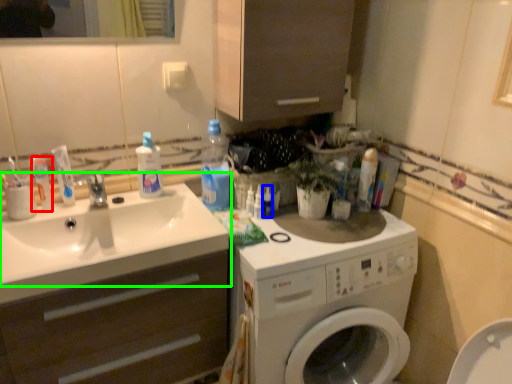
Question: Estimate the real-world distances between objects in this image. Which object is farther from toothpaste (highlighted by a red box), toiletry (highlighted by a blue box) or sink (highlighted by a green box)?

Choices:
 (A) toiletry
 (B) sink

Answer: (A)